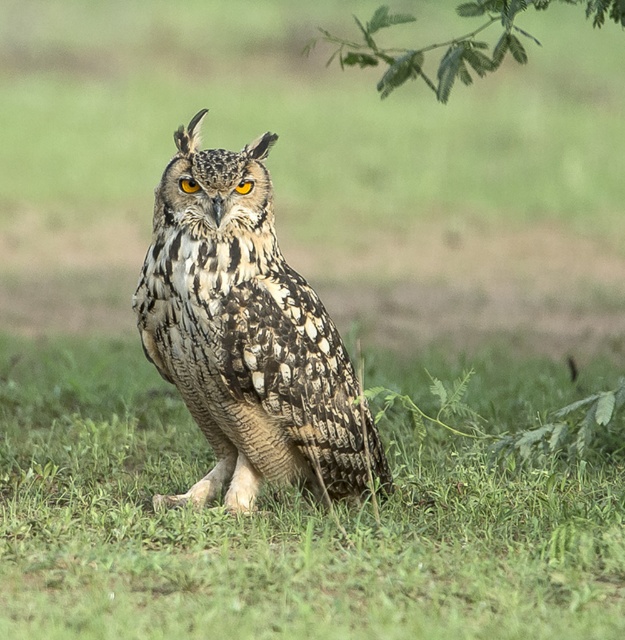
Does camouflage feathered owl at center have a greater height compared to green leafy branch at upper center?

Incorrect, camouflage feathered owl at center's height is not larger of green leafy branch at upper center's.

Is camouflage feathered owl at center to the right of green leafy branch at upper center from the viewer's perspective?

In fact, camouflage feathered owl at center is to the left of green leafy branch at upper center.

The image size is (625, 640). What are the coordinates of `camouflage feathered owl at center` in the screenshot? It's located at (246, 333).

Is speckled feather owl at center smaller than camouflage feathered owl at center?

Incorrect, speckled feather owl at center is not smaller in size than camouflage feathered owl at center.

Which is more to the left, speckled feather owl at center or camouflage feathered owl at center?

From the viewer's perspective, camouflage feathered owl at center appears more on the left side.

Who is more forward, (280, 515) or (218, 300)?

Point (218, 300) is in front.

Locate an element on the screen. This screenshot has height=640, width=625. speckled feather owl at center is located at coordinates (280, 525).

Which is more to the right, speckled feather owl at center or green leafy branch at upper center?

green leafy branch at upper center is more to the right.

Is point (302, 532) farther from camera compared to point (386, 74)?

No, it is not.

The image size is (625, 640). What are the coordinates of `speckled feather owl at center` in the screenshot? It's located at (280, 525).

The image size is (625, 640). I want to click on speckled feather owl at center, so click(280, 525).